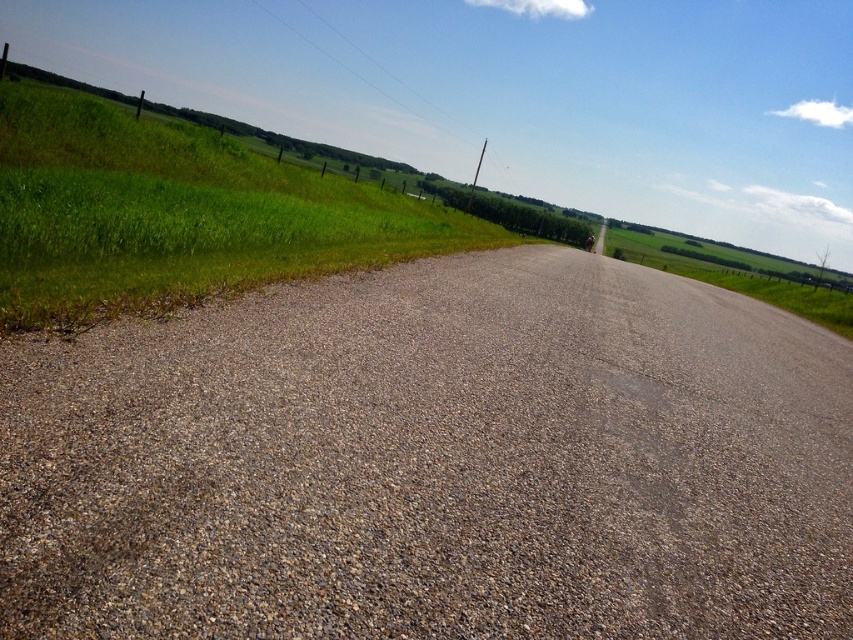
Question: Which of the following is the closest to the observer?

Choices:
 (A) (108, 257)
 (B) (225, 524)

Answer: (B)

Question: Can you confirm if gray gravel at center is positioned to the left of green grass at left?

Choices:
 (A) no
 (B) yes

Answer: (A)

Question: Is gray gravel at center smaller than green grass at left?

Choices:
 (A) no
 (B) yes

Answer: (B)

Question: Does gray gravel at center appear on the right side of green grass at left?

Choices:
 (A) yes
 (B) no

Answer: (A)

Question: Among these objects, which one is farthest from the camera?

Choices:
 (A) gray gravel at center
 (B) green grass at left

Answer: (B)

Question: Among these objects, which one is farthest from the camera?

Choices:
 (A) green grass at left
 (B) gray gravel at center

Answer: (A)